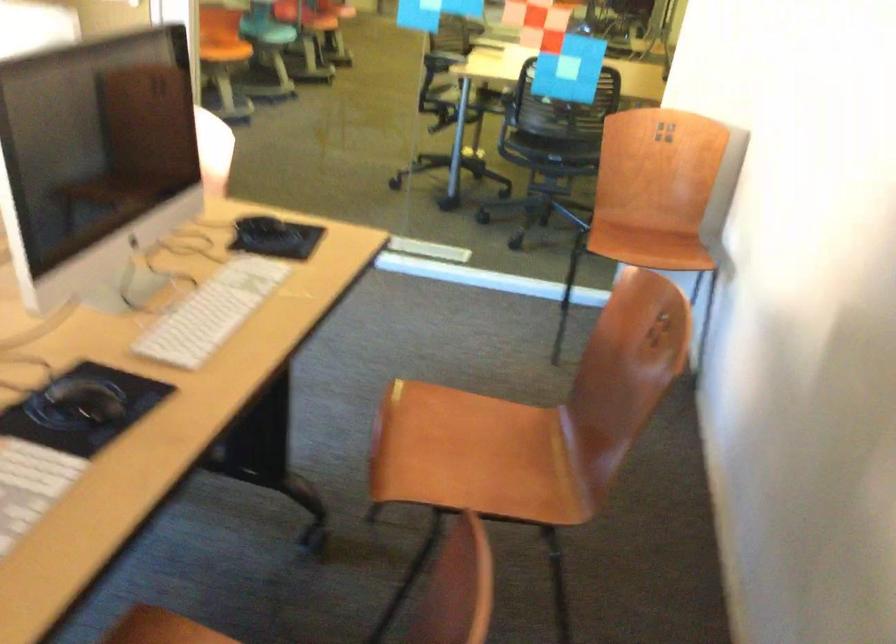
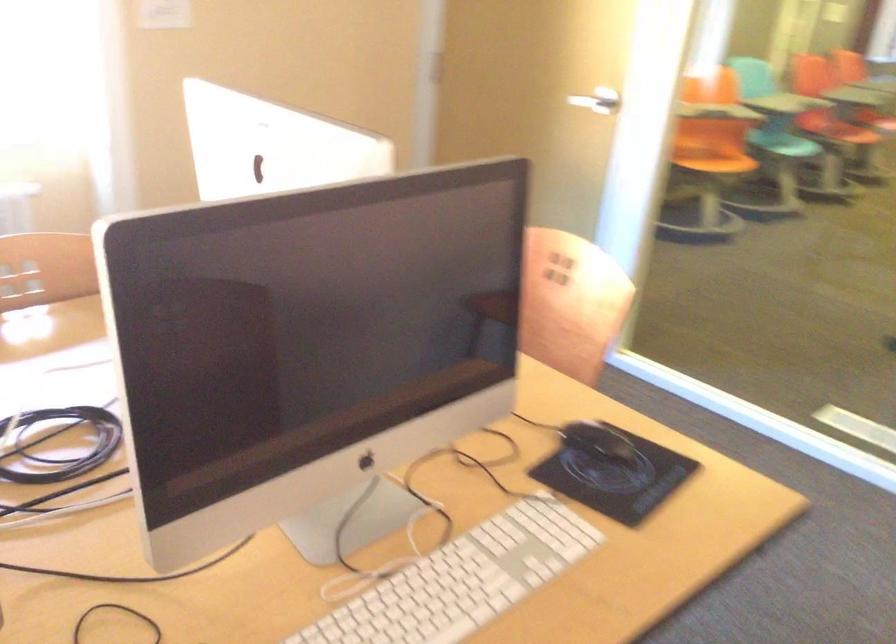
Question: The camera is either moving clockwise (left) or counter-clockwise (right) around the object. The first image is from the beginning of the video and the second image is from the end. Is the camera moving left or right when shooting the video?

Choices:
 (A) Left
 (B) Right

Answer: (B)